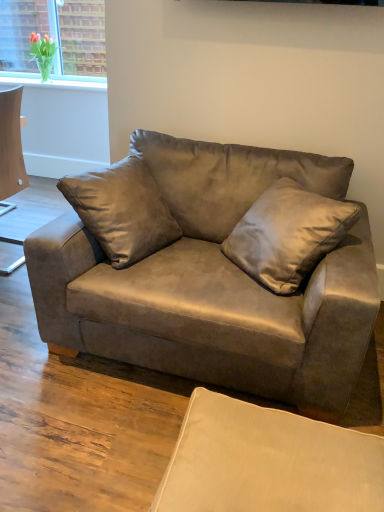
Question: From the image's perspective, is satin brown pillow at center located beneath beige fabric swivel chair at lower right?

Choices:
 (A) no
 (B) yes

Answer: (A)

Question: From a real-world perspective, is satin brown pillow at center over beige fabric swivel chair at lower right?

Choices:
 (A) yes
 (B) no

Answer: (A)

Question: Is the depth of satin brown pillow at center less than that of beige fabric swivel chair at lower right?

Choices:
 (A) no
 (B) yes

Answer: (A)

Question: Is satin brown pillow at center behind beige fabric swivel chair at lower right?

Choices:
 (A) yes
 (B) no

Answer: (A)

Question: Is beige fabric swivel chair at lower right completely or partially inside satin brown pillow at center?

Choices:
 (A) no
 (B) yes

Answer: (A)

Question: Can you confirm if satin brown pillow at center is wider than beige fabric swivel chair at lower right?

Choices:
 (A) yes
 (B) no

Answer: (B)

Question: Can beige fabric swivel chair at lower right be found inside suede couch at center?

Choices:
 (A) yes
 (B) no

Answer: (B)

Question: Can you confirm if suede couch at center is positioned to the left of beige fabric swivel chair at lower right?

Choices:
 (A) no
 (B) yes

Answer: (B)

Question: Does suede couch at center turn towards beige fabric swivel chair at lower right?

Choices:
 (A) yes
 (B) no

Answer: (A)

Question: Is suede couch at center not close to beige fabric swivel chair at lower right?

Choices:
 (A) no
 (B) yes

Answer: (A)

Question: Is suede couch at center closer to camera compared to beige fabric swivel chair at lower right?

Choices:
 (A) no
 (B) yes

Answer: (A)

Question: Is suede couch at center beside beige fabric swivel chair at lower right?

Choices:
 (A) no
 (B) yes

Answer: (A)

Question: Does beige fabric swivel chair at lower right come in front of suede couch at center?

Choices:
 (A) no
 (B) yes

Answer: (B)